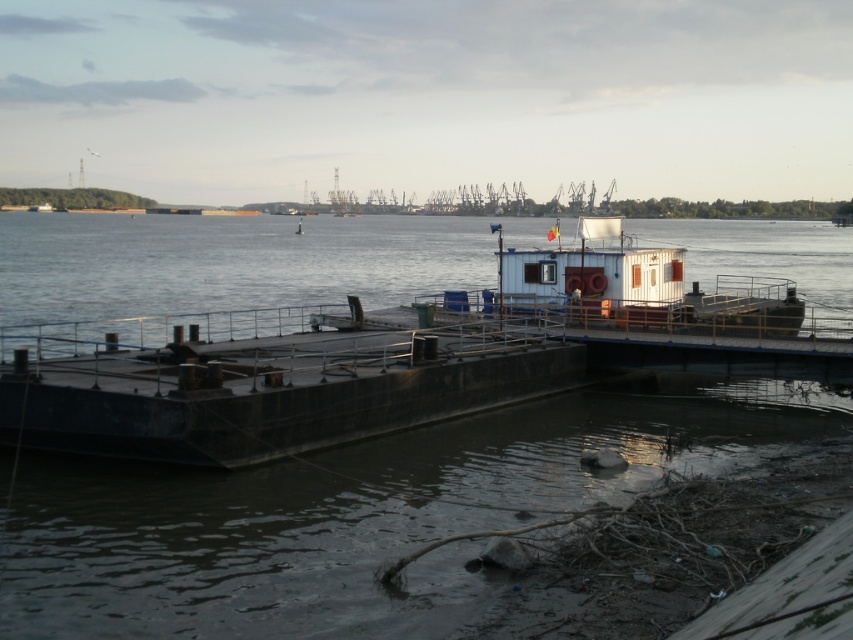
Question: Which of the following is the farthest from the observer?

Choices:
 (A) (93, 557)
 (B) (65, 397)

Answer: (B)

Question: Is brown concrete water at center bigger than dark gray concrete barge at center?

Choices:
 (A) no
 (B) yes

Answer: (B)

Question: Which of the following is the farthest from the observer?

Choices:
 (A) (737, 237)
 (B) (9, 406)

Answer: (A)

Question: Is brown concrete water at center in front of dark gray concrete barge at center?

Choices:
 (A) no
 (B) yes

Answer: (B)

Question: Is brown concrete water at center positioned at the back of dark gray concrete barge at center?

Choices:
 (A) yes
 (B) no

Answer: (B)